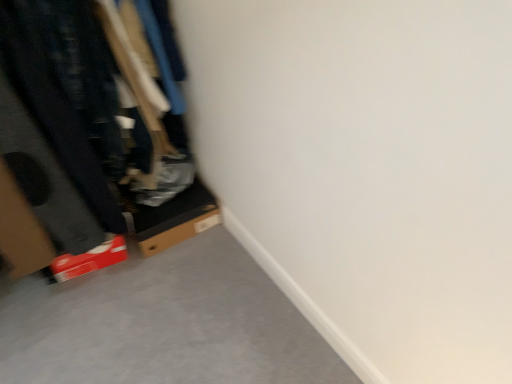
This screenshot has height=384, width=512. What do you see at coordinates (66, 112) in the screenshot?
I see `cardboard box at left` at bounding box center [66, 112].

Where is `cardboard box at left`? This screenshot has height=384, width=512. cardboard box at left is located at coordinates (66, 112).

The height and width of the screenshot is (384, 512). What do you see at coordinates (173, 219) in the screenshot?
I see `cardboard box at lower left` at bounding box center [173, 219].

Where is `cardboard box at lower left`? cardboard box at lower left is located at coordinates (173, 219).

Where is `cardboard box at left`? Image resolution: width=512 pixels, height=384 pixels. cardboard box at left is located at coordinates (66, 112).

In the image, is cardboard box at left on the left side or the right side of cardboard box at lower left?

From the image, it's evident that cardboard box at left is to the left of cardboard box at lower left.

Considering the positions of objects cardboard box at left and cardboard box at lower left in the image provided, who is in front, cardboard box at left or cardboard box at lower left?

cardboard box at left.

Does point (51, 126) appear closer or farther from the camera than point (168, 223)?

Clearly, point (51, 126) is closer to the camera than point (168, 223).

From the image's perspective, between cardboard box at left and cardboard box at lower left, who is located below?

cardboard box at lower left is shown below in the image.

From a real-world perspective, is cardboard box at left physically above cardboard box at lower left?

Indeed, from a real-world perspective, cardboard box at left stands above cardboard box at lower left.

Can you confirm if cardboard box at left is wider than cardboard box at lower left?

Correct, the width of cardboard box at left exceeds that of cardboard box at lower left.

Considering the relative sizes of cardboard box at left and cardboard box at lower left in the image provided, is cardboard box at left shorter than cardboard box at lower left?

Incorrect, the height of cardboard box at left does not fall short of that of cardboard box at lower left.

Who is bigger, cardboard box at left or cardboard box at lower left?

With larger size is cardboard box at left.

In the scene shown: Is cardboard box at left outside of cardboard box at lower left?

Yes, cardboard box at left is located beyond the bounds of cardboard box at lower left.

Are cardboard box at left and cardboard box at lower left beside each other?

No, cardboard box at left is not with cardboard box at lower left.

Is cardboard box at left looking in the opposite direction of cardboard box at lower left?

No, cardboard box at left is not facing away from cardboard box at lower left.

Can you tell me how much cardboard box at left and cardboard box at lower left differ in facing direction?

The angle between the facing direction of cardboard box at left and the facing direction of cardboard box at lower left is 2.4e-05 degrees.

How far apart are cardboard box at left and cardboard box at lower left?

They are 13.63 inches apart.

Where is `cardboard box directly beneath the cardboard box at left (from a real-world perspective)`? This screenshot has height=384, width=512. cardboard box directly beneath the cardboard box at left (from a real-world perspective) is located at coordinates (173, 219).

In the image, is cardboard box at lower left on the left side or the right side of cardboard box at left?

Based on their positions, cardboard box at lower left is located to the right of cardboard box at left.

Is cardboard box at lower left further to the viewer compared to cardboard box at left?

Yes, cardboard box at lower left is further from the camera.

Is point (164, 235) in front of point (110, 142)?

That is False.

From the image's perspective, is cardboard box at lower left above or below cardboard box at left?

Based on their image positions, cardboard box at lower left is located beneath cardboard box at left.

From a real-world perspective, is cardboard box at lower left over cardboard box at left?

Actually, cardboard box at lower left is physically below cardboard box at left in the real world.

Does cardboard box at lower left have a lesser width compared to cardboard box at left?

Yes.

Who is shorter, cardboard box at lower left or cardboard box at left?

cardboard box at lower left.

From the picture: Considering the sizes of objects cardboard box at lower left and cardboard box at left in the image provided, who is smaller, cardboard box at lower left or cardboard box at left?

cardboard box at lower left is smaller.

Is cardboard box at lower left not within cardboard box at left?

Yes, cardboard box at lower left is not within cardboard box at left.

Are cardboard box at lower left and cardboard box at left far apart?

No, there isn't a large distance between cardboard box at lower left and cardboard box at left.

Could you tell me if cardboard box at lower left is facing cardboard box at left?

No.

How many degrees apart are the facing directions of cardboard box at lower left and cardboard box at left?

They differ by 2.4e-05 degrees in their facing directions.

Identify the location of cardboard box behind the cardboard box at left. The height and width of the screenshot is (384, 512). (173, 219).

The width and height of the screenshot is (512, 384). I want to click on cardboard box behind the cardboard box at left, so click(x=173, y=219).

The width and height of the screenshot is (512, 384). What are the coordinates of `cardboard box that appears below the cardboard box at left (from the image's perspective)` in the screenshot? It's located at (173, 219).